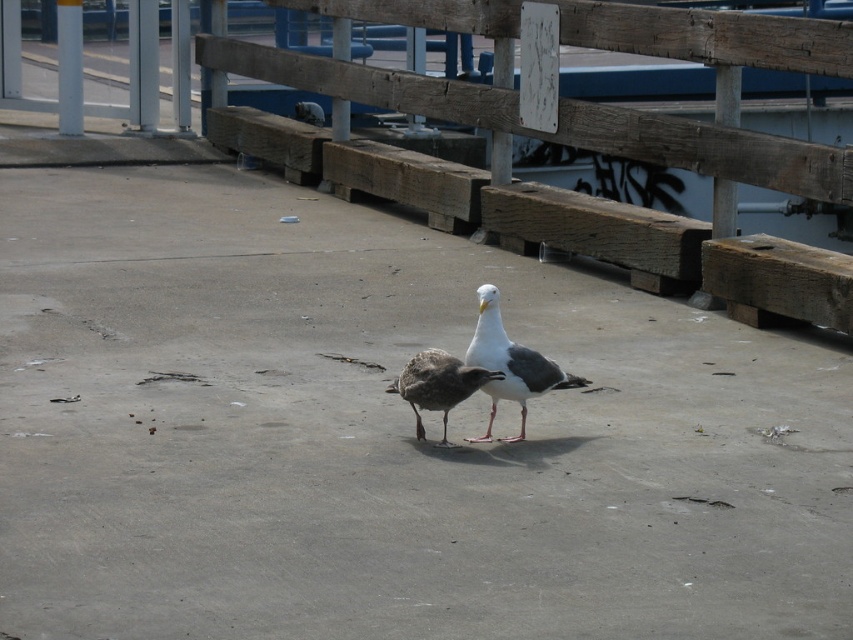
You are standing at the point labeled as point (567,99) in the image. What material are you standing on?

The point (567,99) is labeled as wooden at center, so you are standing on wooden material.

You are a birdwatcher observing the wooden at center and the white matte seagull at center. Which object is taller?

The white matte seagull at center is taller than the wooden at center.